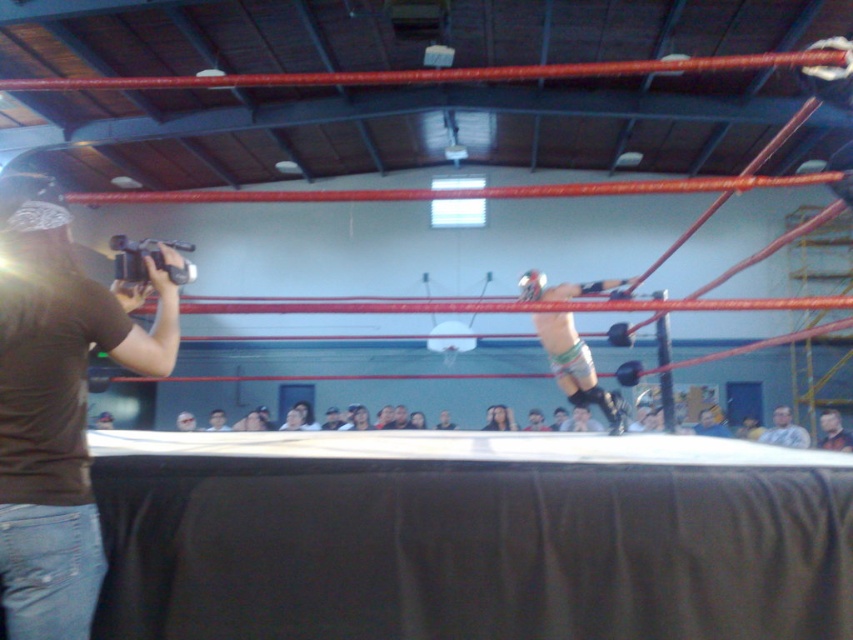
You are a photographer trying to capture a closeup of the smooth skin face at center and the gray fabric shirt at upper right in the wrestling match image. Which object should you zoom in on to ensure both are in frame without moving the camera?

The gray fabric shirt at upper right is wider than the smooth skin face at center, so you should zoom in on the gray fabric shirt at upper right to ensure both are in frame without moving the camera.

You are a photographer standing at the center of the gymnasium floor. You want to take a photo of both point (772, 420) and point (405, 412) in the wrestling ring. Which point should you focus on first to ensure both are in clear view?

You should focus on point (772, 420) first because it is closer to the camera than point (405, 412), ensuring both points are in focus when using a shallow depth of field.

You are a photographer positioned at the center of the gymnasium. You want to take a photo of the smooth skin face at center and the gray fabric shirt at upper right. Given that your camera has a maximum focus range of 3 meters, will both subjects be within the focus range?

The gray fabric shirt at upper right is 3.62 meters away from the smooth skin face at center. Since the camera can only focus up to 3 meters, the gray fabric shirt at upper right is beyond the focus range and cannot be captured clearly.